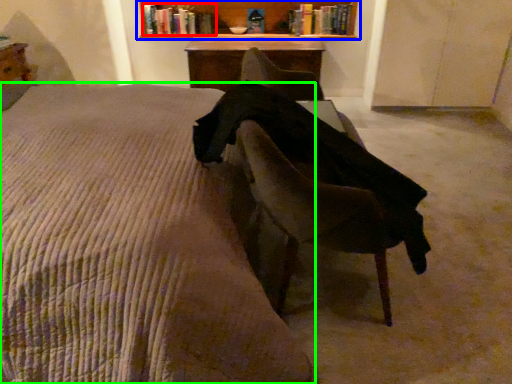
Question: Which object is the farthest from book (highlighted by a red box)? Choose among these: shelf (highlighted by a blue box) or bed (highlighted by a green box).

Choices:
 (A) shelf
 (B) bed

Answer: (B)